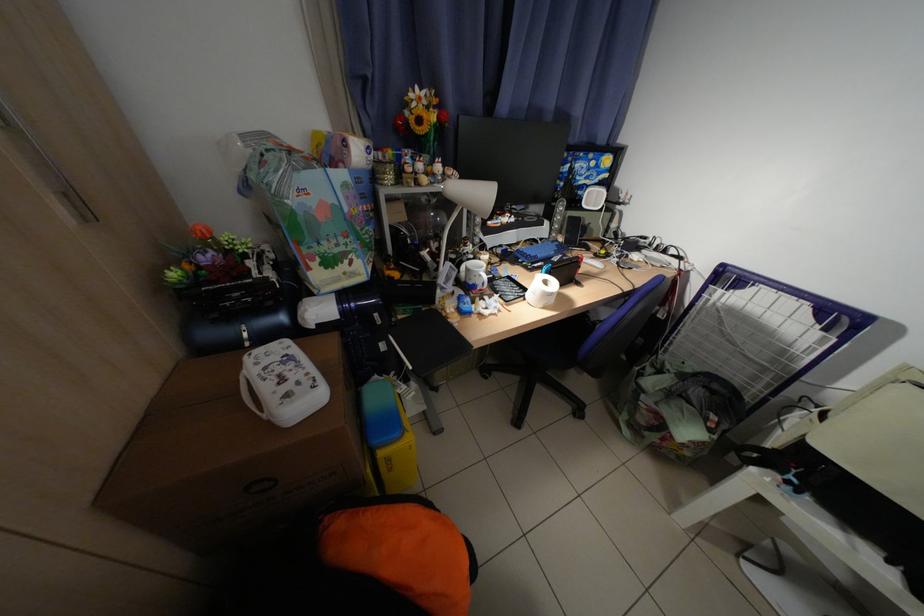
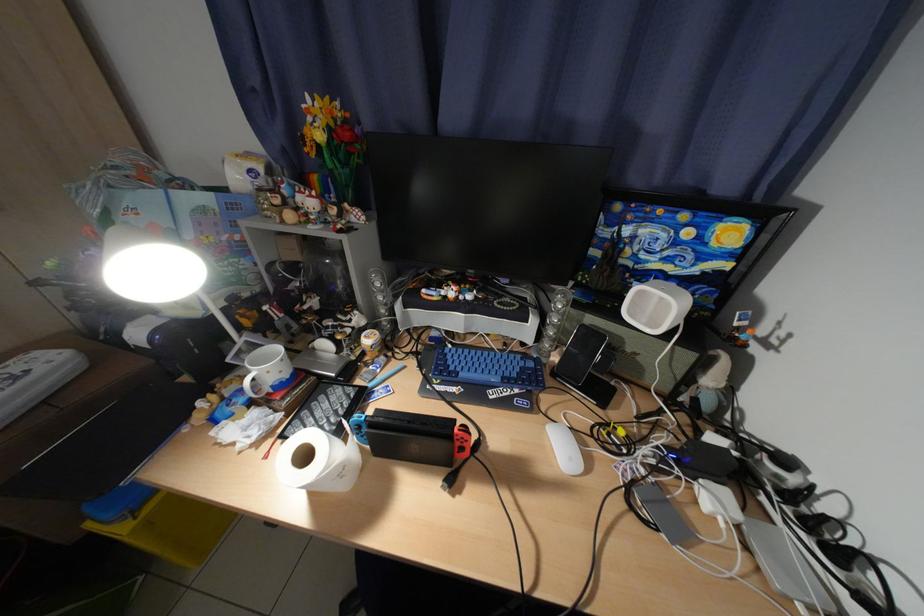
In the second image, find the point that corresponds to point 495,257 in the first image.

(381, 341)